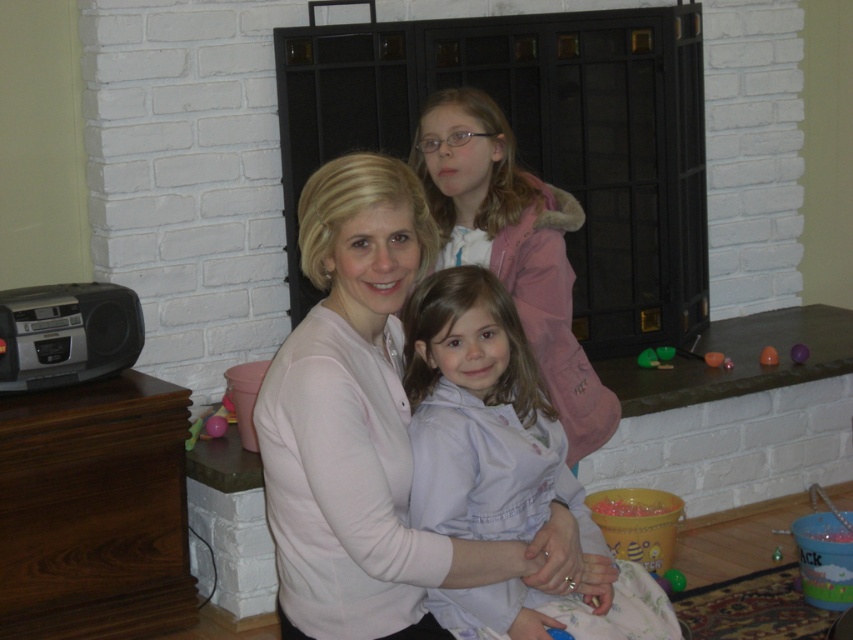
Question: Is the position of matte pink sweater at center more distant than that of light blue fabric at center?

Choices:
 (A) no
 (B) yes

Answer: (A)

Question: Which point is farther to the camera?

Choices:
 (A) matte pink sweater at center
 (B) light blue fabric at center

Answer: (B)

Question: Can you confirm if matte pink sweater at center is positioned below light blue fabric at center?

Choices:
 (A) yes
 (B) no

Answer: (B)

Question: Can you confirm if matte pink sweater at center is wider than light blue fabric at center?

Choices:
 (A) no
 (B) yes

Answer: (B)